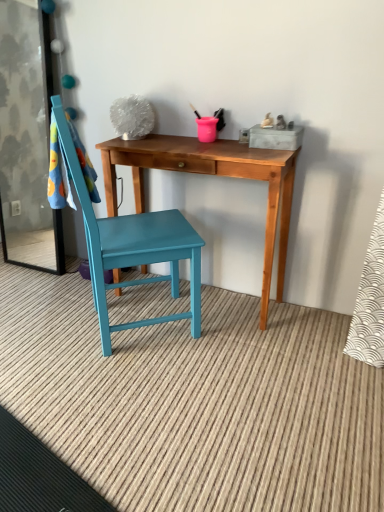
Image resolution: width=384 pixels, height=512 pixels. Find the location of `free spot in front of wooden desk at center`. free spot in front of wooden desk at center is located at coordinates [x=207, y=378].